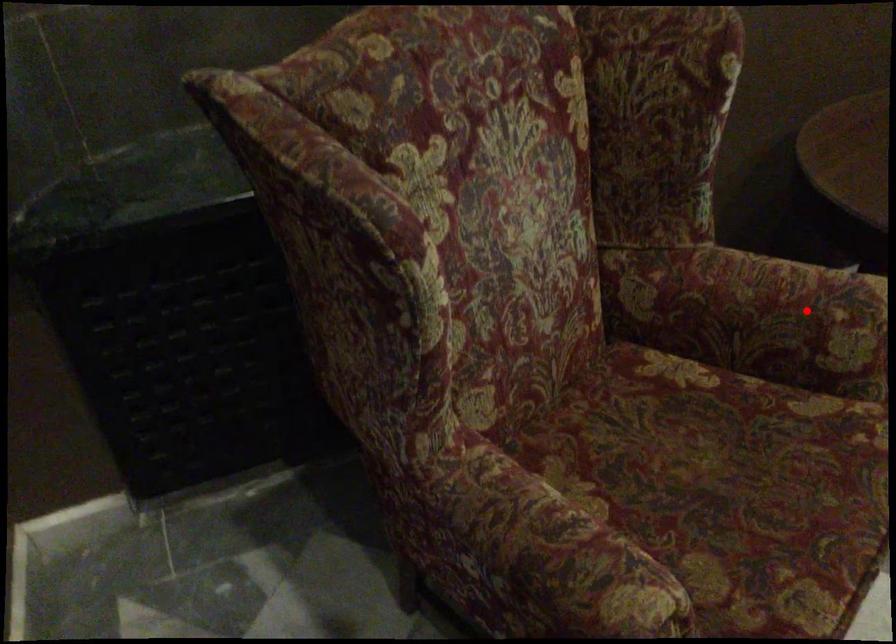
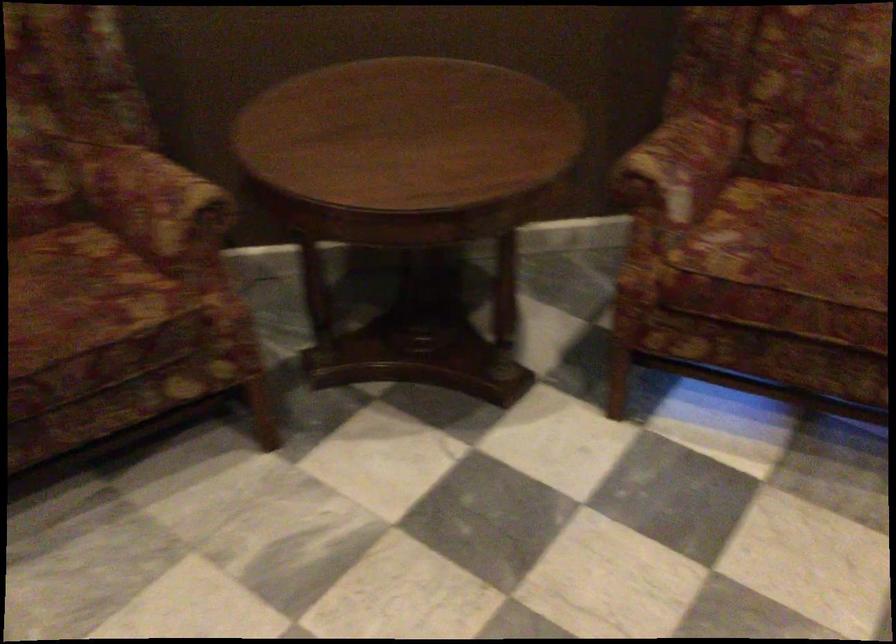
Question: I am providing you with two images of the same scene from different viewpoints. In image1, a red point is highlighted. Considering the same 3D point in image2, which of the following is correct?

Choices:
 (A) It is closer
 (B) It is farther

Answer: (B)